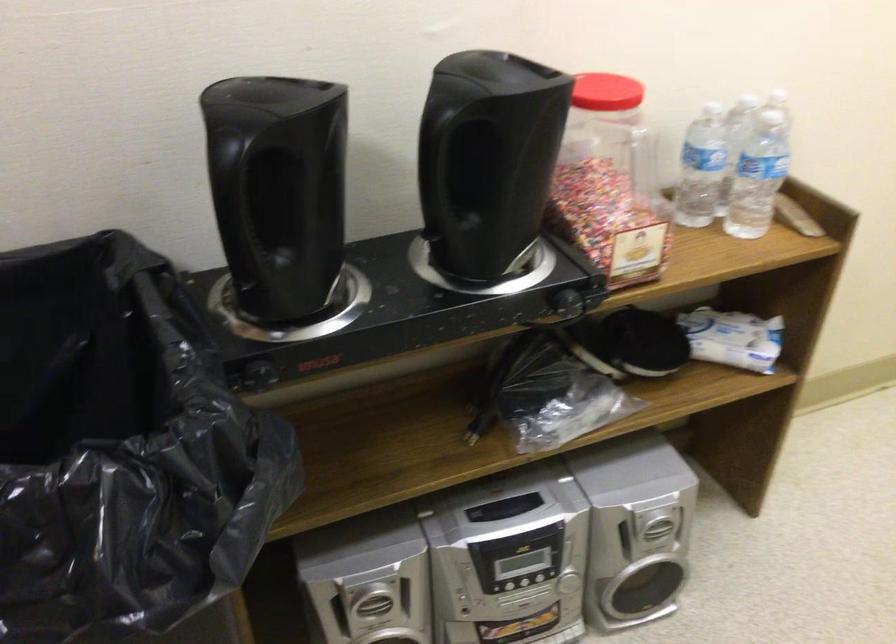
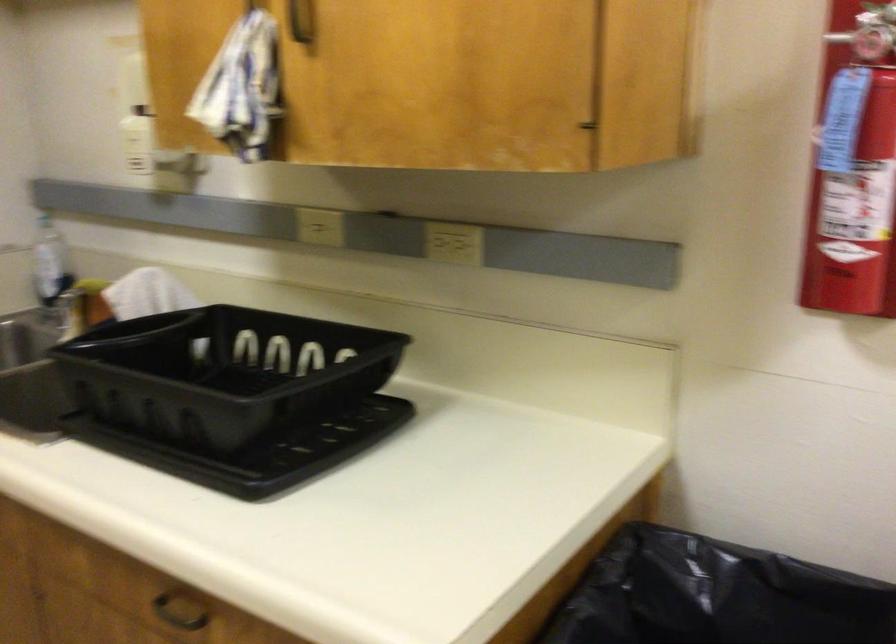
Question: The camera is either moving clockwise (left) or counter-clockwise (right) around the object. The first image is from the beginning of the video and the second image is from the end. Is the camera moving left or right when shooting the video?

Choices:
 (A) Left
 (B) Right

Answer: (B)